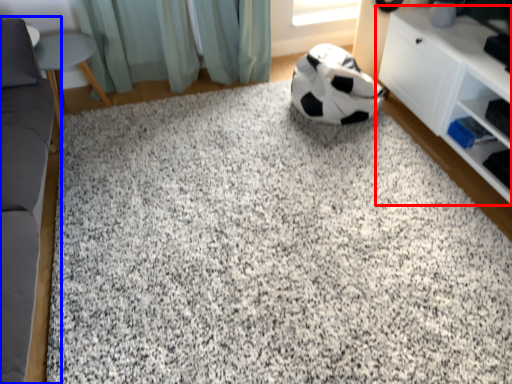
Question: Which point is further to the camera, shelf (highlighted by a red box) or furniture (highlighted by a blue box)?

Choices:
 (A) shelf
 (B) furniture

Answer: (A)